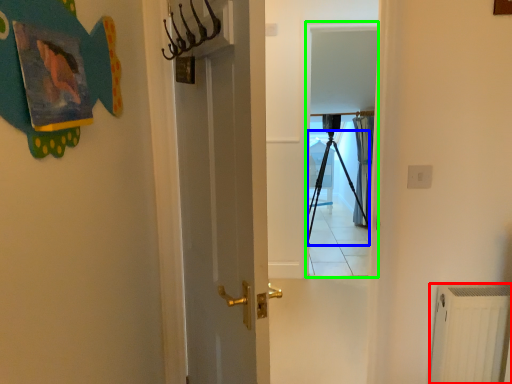
Question: Considering the real-world distances, which object is closest to radiator (highlighted by a red box)? tripod (highlighted by a blue box) or screen door (highlighted by a green box).

Choices:
 (A) tripod
 (B) screen door

Answer: (B)